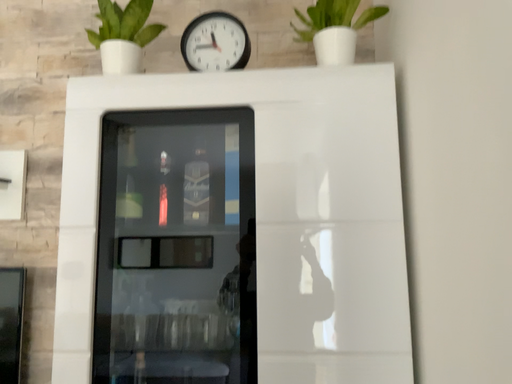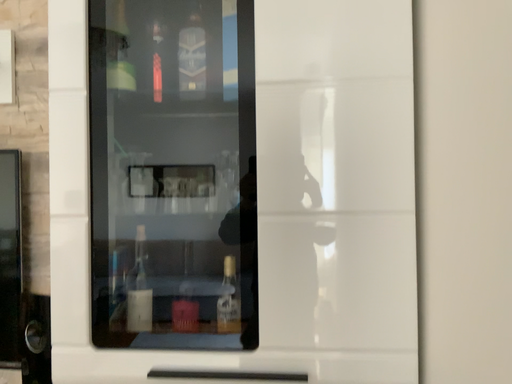
Question: How did the camera likely rotate when shooting the video?

Choices:
 (A) rotated upward
 (B) rotated downward

Answer: (B)